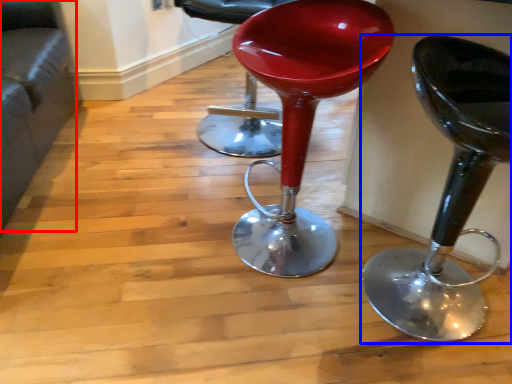
Question: Which point is closer to the camera, couch (highlighted by a red box) or stool (highlighted by a blue box)?

Choices:
 (A) couch
 (B) stool

Answer: (B)